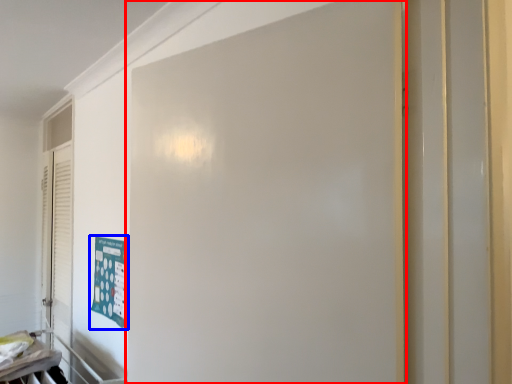
Question: Which point is closer to the camera, door (highlighted by a red box) or poster (highlighted by a blue box)?

Choices:
 (A) door
 (B) poster

Answer: (A)